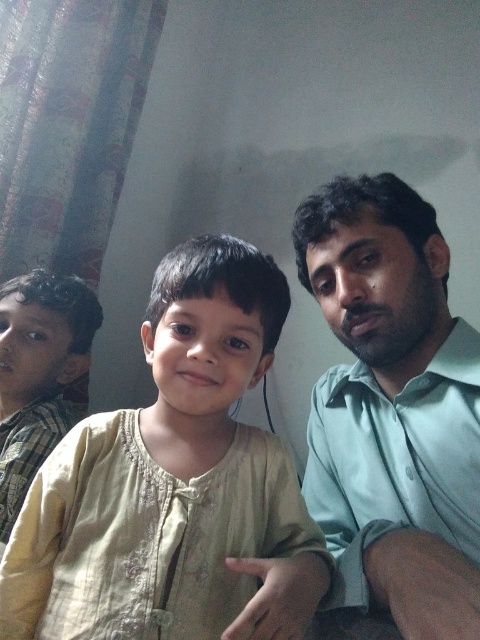
Is point (406, 353) closer to viewer compared to point (92, 324)?

Yes, it is in front of point (92, 324).

Describe the element at coordinates (393, 408) in the screenshot. The width and height of the screenshot is (480, 640). I see `green matte shirt at right` at that location.

Which is behind, point (360, 294) or point (64, 428)?

The point (64, 428) is more distant.

Identify the location of green matte shirt at right. (393, 408).

Can you confirm if light beige fabric at center is shorter than green matte shirt at right?

Yes.

Between light beige fabric at center and green matte shirt at right, which one appears on the left side from the viewer's perspective?

light beige fabric at center

At what (x,y) coordinates should I click in order to perform the action: click on light beige fabric at center. Please return your answer as a coordinate pair (x, y). The width and height of the screenshot is (480, 640). Looking at the image, I should click on (175, 483).

The height and width of the screenshot is (640, 480). Find the location of `light beige fabric at center`. light beige fabric at center is located at coordinates (175, 483).

Is light beige fabric at center below light brown plaid shirt at left?

Actually, light beige fabric at center is above light brown plaid shirt at left.

The image size is (480, 640). Find the location of `light beige fabric at center`. light beige fabric at center is located at coordinates (175, 483).

Is point (195, 300) behind point (32, 369)?

That is False.

Find the location of `light beige fabric at center`. light beige fabric at center is located at coordinates (175, 483).